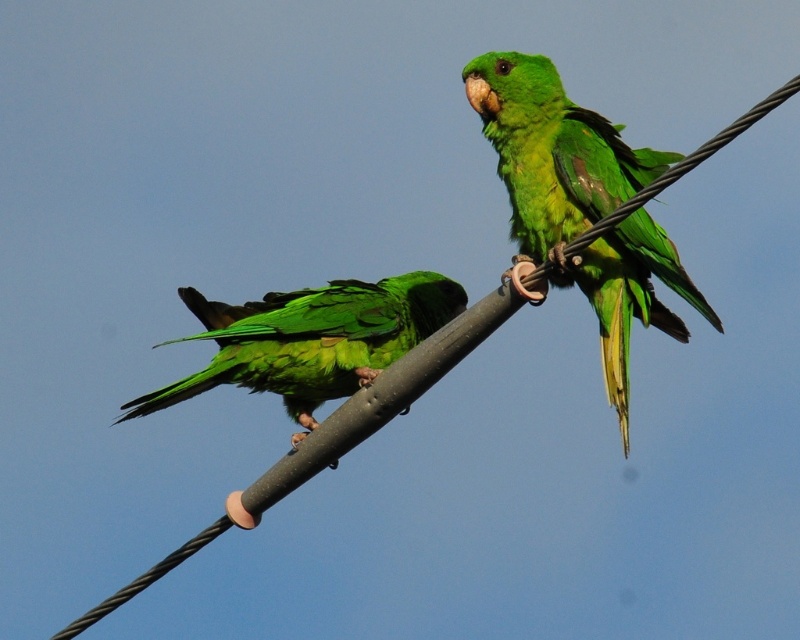
Does green matte parrot at upper right appear on the left side of green matte parrot at left?

No, green matte parrot at upper right is not to the left of green matte parrot at left.

Based on the photo, is green matte parrot at upper right wider than green matte parrot at left?

Incorrect, green matte parrot at upper right's width does not surpass green matte parrot at left's.

This screenshot has width=800, height=640. What do you see at coordinates (580, 204) in the screenshot?
I see `green matte parrot at upper right` at bounding box center [580, 204].

The width and height of the screenshot is (800, 640). I want to click on green matte parrot at upper right, so click(580, 204).